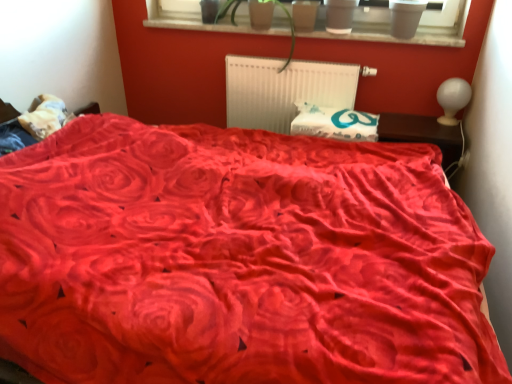
Question: Is brown wooden table at right taller or shorter than velvet red bed at center?

Choices:
 (A) short
 (B) tall

Answer: (A)

Question: From a real-world perspective, is brown wooden table at right above or below velvet red bed at center?

Choices:
 (A) above
 (B) below

Answer: (A)

Question: Based on their relative distances, which object is farther from the white glossy lampshade at upper right?

Choices:
 (A) white plastic radiator at center
 (B) smooth wood window sill at upper center
 (C) velvet red bed at center
 (D) matte plastic pots at upper center
 (E) brown wooden table at right

Answer: (C)

Question: Which object is the closest to the white plastic radiator at center?

Choices:
 (A) green leafy plant at upper center
 (B) brown wooden table at right
 (C) matte gray flowerpot at upper center, the first flowerpot from the right
 (D) velvet red bed at center
 (E) matte plastic flowerpot at upper center, placed as the 2th flowerpot when sorted from right to left

Answer: (A)